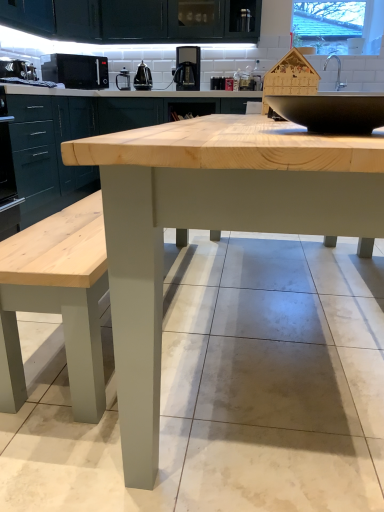
Describe the element at coordinates (128, 113) in the screenshot. This screenshot has width=384, height=512. I see `green matte cabinet at center, which is counted as the second cabinetry, starting from the left` at that location.

The height and width of the screenshot is (512, 384). What do you see at coordinates (211, 224) in the screenshot?
I see `natural wood table at center` at bounding box center [211, 224].

What do you see at coordinates (45, 155) in the screenshot?
I see `matte pine cabinet at left, the first cabinetry when ordered from left to right` at bounding box center [45, 155].

What is the approximate width of satin black kettle at upper center, the third appliance positioned from the front?

7.79 inches.

Find the location of a particular element. The image size is (384, 512). green matte cabinet at center, the 1th cabinetry from the right is located at coordinates (128, 113).

From the image's perspective, is natural wood table at center below matte pine cabinet at left, which appears as the 2th cabinetry when viewed from the right?

Yes.

Is natural wood table at center beside matte pine cabinet at left, the first cabinetry when ordered from left to right?

There is a gap between natural wood table at center and matte pine cabinet at left, the first cabinetry when ordered from left to right.

Which object is more forward, natural wood table at center or matte pine cabinet at left, which appears as the 2th cabinetry when viewed from the right?

natural wood table at center is in front.

Considering the relative sizes of natural wood table at center and matte pine cabinet at left, which appears as the 2th cabinetry when viewed from the right, in the image provided, is natural wood table at center taller than matte pine cabinet at left, which appears as the 2th cabinetry when viewed from the right,?

No.

At what (x,y) coordinates should I click in order to perform the action: click on appliance that is the 2nd one when counting leftward from the matte black coffee maker at upper center, the first appliance when ordered from back to front. Please return your answer as a coordinate pair (x, y). This screenshot has width=384, height=512. Looking at the image, I should click on [17, 69].

From a real-world perspective, is matte black coffee maker at upper center, arranged as the fourth appliance when viewed from the front, positioned over black matte microwave at upper left, placed as the 4th appliance when sorted from right to left, based on gravity?

Actually, matte black coffee maker at upper center, arranged as the fourth appliance when viewed from the front, is physically below black matte microwave at upper left, placed as the 4th appliance when sorted from right to left, in the real world.

From the image's perspective, is matte black coffee maker at upper center, which is the 3th appliance from left to right, located above or below black matte microwave at upper left, acting as the fourth appliance starting from the back?

Based on their image positions, matte black coffee maker at upper center, which is the 3th appliance from left to right, is located above black matte microwave at upper left, acting as the fourth appliance starting from the back.

How many degrees apart are the facing directions of matte black coffee maker at upper center, marked as the second appliance in a right-to-left arrangement, and black matte microwave at upper left, which is counted as the 1th appliance, starting from the left?

They differ by 91.2 degrees in their facing directions.

Is green matte cabinet at center, which is counted as the second cabinetry, starting from the left, at the left side of natural wood table at center?

Yes, green matte cabinet at center, which is counted as the second cabinetry, starting from the left, is to the left of natural wood table at center.

Is green matte cabinet at center, the 1th cabinetry from the right, inside the boundaries of natural wood table at center, or outside?

green matte cabinet at center, the 1th cabinetry from the right, exists outside the volume of natural wood table at center.

How many degrees apart are the facing directions of green matte cabinet at center, which is counted as the second cabinetry, starting from the left, and natural wood table at center?

The angular difference between green matte cabinet at center, which is counted as the second cabinetry, starting from the left, and natural wood table at center is 178 degrees.

Measure the distance from black matte microwave at upper left, which is the 1th appliance in front-to-back order, to matte pine cabinet at left, the first cabinetry when ordered from left to right.

They are 23.85 inches apart.

From the image's perspective, which one is positioned higher, black matte microwave at upper left, which is the 1th appliance in front-to-back order, or matte pine cabinet at left, which appears as the 2th cabinetry when viewed from the right?

black matte microwave at upper left, which is the 1th appliance in front-to-back order.

Which of these two, black matte microwave at upper left, which is the 1th appliance in front-to-back order, or matte pine cabinet at left, which appears as the 2th cabinetry when viewed from the right, stands shorter?

black matte microwave at upper left, which is the 1th appliance in front-to-back order.

Is black matte microwave at upper left, which is counted as the 1th appliance, starting from the left, positioned far away from matte pine cabinet at left, which appears as the 2th cabinetry when viewed from the right?

Actually, black matte microwave at upper left, which is counted as the 1th appliance, starting from the left, and matte pine cabinet at left, which appears as the 2th cabinetry when viewed from the right, are a little close together.

Can you confirm if matte black coffee maker at upper center, arranged as the fourth appliance when viewed from the front, is positioned to the left of green matte cabinet at center, the 1th cabinetry from the right?

Yes, matte black coffee maker at upper center, arranged as the fourth appliance when viewed from the front, is to the left of green matte cabinet at center, the 1th cabinetry from the right.

From the image's perspective, relative to green matte cabinet at center, which is counted as the second cabinetry, starting from the left, is matte black coffee maker at upper center, which is the 3th appliance from left to right, above or below?

From the image's perspective, matte black coffee maker at upper center, which is the 3th appliance from left to right, appears above green matte cabinet at center, which is counted as the second cabinetry, starting from the left.

Could you tell me if matte black coffee maker at upper center, marked as the second appliance in a right-to-left arrangement, is turned towards green matte cabinet at center, which is counted as the second cabinetry, starting from the left?

No, matte black coffee maker at upper center, marked as the second appliance in a right-to-left arrangement, does not turn towards green matte cabinet at center, which is counted as the second cabinetry, starting from the left.

Identify the location of appliance in front of the black matte microwave at upper left, the third appliance in the back-to-front sequence. (17, 69).

Does black matte microwave at upper left, arranged as the 3th appliance when viewed from the right, have a lesser height compared to black matte microwave at upper left, acting as the fourth appliance starting from the back?

No, black matte microwave at upper left, arranged as the 3th appliance when viewed from the right, is not shorter than black matte microwave at upper left, acting as the fourth appliance starting from the back.

How much distance is there between black matte microwave at upper left, which is counted as the 2th appliance, starting from the front, and black matte microwave at upper left, acting as the fourth appliance starting from the back?

black matte microwave at upper left, which is counted as the 2th appliance, starting from the front, and black matte microwave at upper left, acting as the fourth appliance starting from the back, are 50.39 centimeters apart from each other.

Considering the positions of point (42, 73) and point (2, 72), is point (42, 73) closer or farther from the camera than point (2, 72)?

Point (42, 73) is positioned farther from the camera compared to point (2, 72).

In the scene shown: Considering the relative positions of black matte microwave at upper left, which is the 1th appliance in front-to-back order, and transparent glass window at upper right in the image provided, is black matte microwave at upper left, which is the 1th appliance in front-to-back order, to the left of transparent glass window at upper right from the viewer's perspective?

Correct, you'll find black matte microwave at upper left, which is the 1th appliance in front-to-back order, to the left of transparent glass window at upper right.

Are black matte microwave at upper left, which is counted as the 1th appliance, starting from the left, and transparent glass window at upper right far apart?

Yes, black matte microwave at upper left, which is counted as the 1th appliance, starting from the left, is far from transparent glass window at upper right.

Is point (27, 73) farther from viewer compared to point (382, 24)?

No, it is in front of (382, 24).

Identify the location of table located in front of the matte pine cabinet at left, the first cabinetry when ordered from left to right. (211, 224).

Locate an element on the screen. the 3rd appliance above the black matte microwave at upper left, placed as the 4th appliance when sorted from right to left (from the image's perspective) is located at coordinates (123, 80).

Considering their positions, is matte pine cabinet at left, which appears as the 2th cabinetry when viewed from the right, positioned further to black matte microwave at upper left, placed as the 4th appliance when sorted from right to left, than satin black kettle at upper center, the second appliance when ordered from back to front?

satin black kettle at upper center, the second appliance when ordered from back to front, is positioned further to the anchor black matte microwave at upper left, placed as the 4th appliance when sorted from right to left.

Based on the photo, when comparing their distances from transparent glass window at upper right, does black matte microwave at upper left, acting as the 2th appliance starting from the left, or black matte microwave at upper left, acting as the fourth appliance starting from the back, seem further?

The object further to transparent glass window at upper right is black matte microwave at upper left, acting as the fourth appliance starting from the back.

Considering their positions, is natural wood table at center positioned further to black matte microwave at upper left, placed as the 4th appliance when sorted from right to left, than matte black coffee maker at upper center, the first appliance when ordered from back to front?

natural wood table at center is positioned further to the anchor black matte microwave at upper left, placed as the 4th appliance when sorted from right to left.

From the image, which object appears to be farther from black matte microwave at upper left, which is counted as the 2th appliance, starting from the front, satin black kettle at upper center, the fourth appliance from the left, or matte pine cabinet at left, which appears as the 2th cabinetry when viewed from the right?

Among the two, matte pine cabinet at left, which appears as the 2th cabinetry when viewed from the right, is located further to black matte microwave at upper left, which is counted as the 2th appliance, starting from the front.

From the image, which object appears to be farther from satin black coffee machine at upper center, natural wood table at center or transparent glass window at upper right?

natural wood table at center is further to satin black coffee machine at upper center.

Looking at the image, which one is located further to satin black kettle at upper center, the third appliance positioned from the front, black matte microwave at upper left, the third appliance in the back-to-front sequence, or matte pine cabinet at left, which appears as the 2th cabinetry when viewed from the right?

The object further to satin black kettle at upper center, the third appliance positioned from the front, is matte pine cabinet at left, which appears as the 2th cabinetry when viewed from the right.

Estimate the real-world distances between objects in this image. Which object is further from matte pine cabinet at left, the first cabinetry when ordered from left to right, matte black coffee maker at upper center, arranged as the fourth appliance when viewed from the front, or black matte microwave at upper left, which is the 1th appliance in front-to-back order?

Among the two, matte black coffee maker at upper center, arranged as the fourth appliance when viewed from the front, is located further to matte pine cabinet at left, the first cabinetry when ordered from left to right.

Considering their positions, is black matte microwave at upper left, which is counted as the 1th appliance, starting from the left, positioned closer to natural wood table at center than transparent glass window at upper right?

black matte microwave at upper left, which is counted as the 1th appliance, starting from the left, lies closer to natural wood table at center than the other object.

Find the location of `coffee machine between black matte microwave at upper left, which is counted as the 2th appliance, starting from the front, and transparent glass window at upper right, in the horizontal direction`. coffee machine between black matte microwave at upper left, which is counted as the 2th appliance, starting from the front, and transparent glass window at upper right, in the horizontal direction is located at coordinates coord(187,68).

In order to click on coffee machine between matte pine cabinet at left, the first cabinetry when ordered from left to right, and matte black coffee maker at upper center, the first appliance when ordered from back to front, from front to back in this screenshot , I will do `click(187, 68)`.

Where is `coffee machine between matte pine cabinet at left, which appears as the 2th cabinetry when viewed from the right, and green matte cabinet at center, which is counted as the second cabinetry, starting from the left, along the z-axis`? This screenshot has height=512, width=384. coffee machine between matte pine cabinet at left, which appears as the 2th cabinetry when viewed from the right, and green matte cabinet at center, which is counted as the second cabinetry, starting from the left, along the z-axis is located at coordinates (187, 68).

Identify the location of cabinetry between natural wood table at center and satin black coffee machine at upper center along the z-axis. The image size is (384, 512). (45, 155).